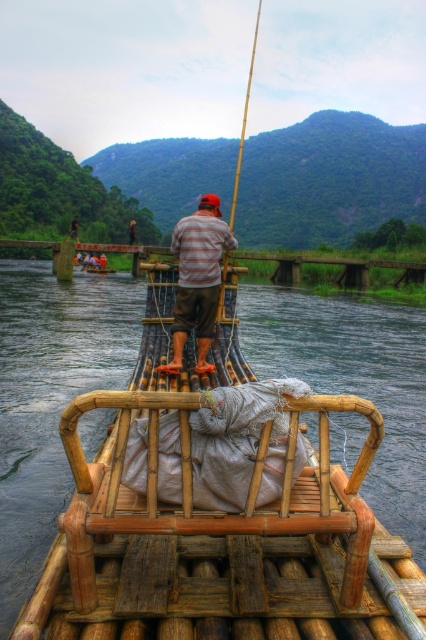
Can you confirm if brown wooden raft at center is shorter than striped fabric shirt at center?

Incorrect, brown wooden raft at center's height does not fall short of striped fabric shirt at center's.

Is point (379, 396) farther from viewer compared to point (204, 273)?

Yes, point (379, 396) is farther from viewer.

This screenshot has height=640, width=426. Find the location of `brown wooden raft at center`. brown wooden raft at center is located at coordinates (51, 397).